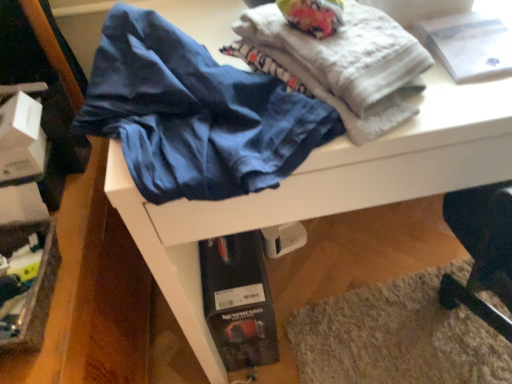
Image resolution: width=512 pixels, height=384 pixels. Identify the location of white textured towel at upper center. (338, 64).

The image size is (512, 384). What do you see at coordinates (194, 114) in the screenshot?
I see `matte blue underwear at center` at bounding box center [194, 114].

Where is `white textured towel at upper center`? The width and height of the screenshot is (512, 384). white textured towel at upper center is located at coordinates (338, 64).

Is white textured towel at upper center placed right next to matte blue underwear at center?

No, white textured towel at upper center is not beside matte blue underwear at center.

Considering the sizes of objects white textured towel at upper center and matte blue underwear at center in the image provided, who is thinner, white textured towel at upper center or matte blue underwear at center?

white textured towel at upper center.

From the image's perspective, is white textured towel at upper center beneath matte blue underwear at center?

No, from the image's perspective, white textured towel at upper center is not below matte blue underwear at center.

Is matte blue underwear at center taller or shorter than white textured towel at upper center?

matte blue underwear at center is taller than white textured towel at upper center.

From the image's perspective, is matte blue underwear at center on white textured towel at upper center?

No.

Considering the relative positions of matte blue underwear at center and white textured towel at upper center in the image provided, is matte blue underwear at center to the left of white textured towel at upper center from the viewer's perspective?

Yes.

Consider the image. From a real-world perspective, which is physically above, matte blue underwear at center or white textured towel at upper center?

white textured towel at upper center is physically above.

Considering the relative sizes of white paper at upper right and white textured towel at upper center in the image provided, is white paper at upper right bigger than white textured towel at upper center?

No.

In the scene shown: Considering the relative positions of white paper at upper right and white textured towel at upper center in the image provided, is white paper at upper right to the left of white textured towel at upper center from the viewer's perspective?

Incorrect, white paper at upper right is not on the left side of white textured towel at upper center.

Identify the location of fabric that appears in front of the white paper at upper right. (338, 64).

How different are the orientations of white paper at upper right and white textured towel at upper center in degrees?

20.9 degrees separate the facing orientations of white paper at upper right and white textured towel at upper center.

Which is in front, white paper at upper right or matte blue underwear at center?

matte blue underwear at center is more forward.

Is white paper at upper right not close to matte blue underwear at center?

white paper at upper right is actually quite close to matte blue underwear at center.

In the image, is white paper at upper right on the left side or the right side of matte blue underwear at center?

white paper at upper right is positioned on matte blue underwear at center's right side.

Consider the image. What's the angular difference between matte blue underwear at center and white paper at upper right's facing directions?

They differ by 22.9 degrees in their facing directions.

From a real-world perspective, is matte blue underwear at center positioned above or below white paper at upper right?

Clearly, from a real-world perspective, matte blue underwear at center is above white paper at upper right.

From the image's perspective, which is below, matte blue underwear at center or white paper at upper right?

matte blue underwear at center appears lower in the image.

From the image's perspective, is white textured towel at upper center located above or below white paper at upper right?

From the image's perspective, white textured towel at upper center appears below white paper at upper right.

Considering the sizes of white textured towel at upper center and white paper at upper right in the image, is white textured towel at upper center bigger or smaller than white paper at upper right?

In the image, white textured towel at upper center appears to be larger than white paper at upper right.

Is white textured towel at upper center located outside white paper at upper right?

Absolutely, white textured towel at upper center is external to white paper at upper right.

Locate an element on the screen. The image size is (512, 384). clothing located in front of the white textured towel at upper center is located at coordinates (194, 114).

This screenshot has height=384, width=512. In order to click on fabric on the right side of matte blue underwear at center in this screenshot , I will do `click(338, 64)`.

Estimate the real-world distances between objects in this image. Which object is further from white textured towel at upper center, matte blue underwear at center or white paper at upper right?

The object further to white textured towel at upper center is white paper at upper right.

When comparing their distances from white paper at upper right, does white textured towel at upper center or matte blue underwear at center seem closer?

white textured towel at upper center is positioned closer to the anchor white paper at upper right.

From the picture: Considering their positions, is white textured towel at upper center positioned closer to matte blue underwear at center than white paper at upper right?

The object closer to matte blue underwear at center is white textured towel at upper center.

Estimate the real-world distances between objects in this image. Which object is closer to white textured towel at upper center, white paper at upper right or matte blue underwear at center?

matte blue underwear at center is positioned closer to the anchor white textured towel at upper center.

Looking at the image, which one is located closer to matte blue underwear at center, white paper at upper right or white textured towel at upper center?

white textured towel at upper center lies closer to matte blue underwear at center than the other object.

Based on their spatial positions, is matte blue underwear at center or white textured towel at upper center closer to white paper at upper right?

The object closer to white paper at upper right is white textured towel at upper center.

Locate an element on the screen. The width and height of the screenshot is (512, 384). fabric between matte blue underwear at center and white paper at upper right in the horizontal direction is located at coordinates (338, 64).